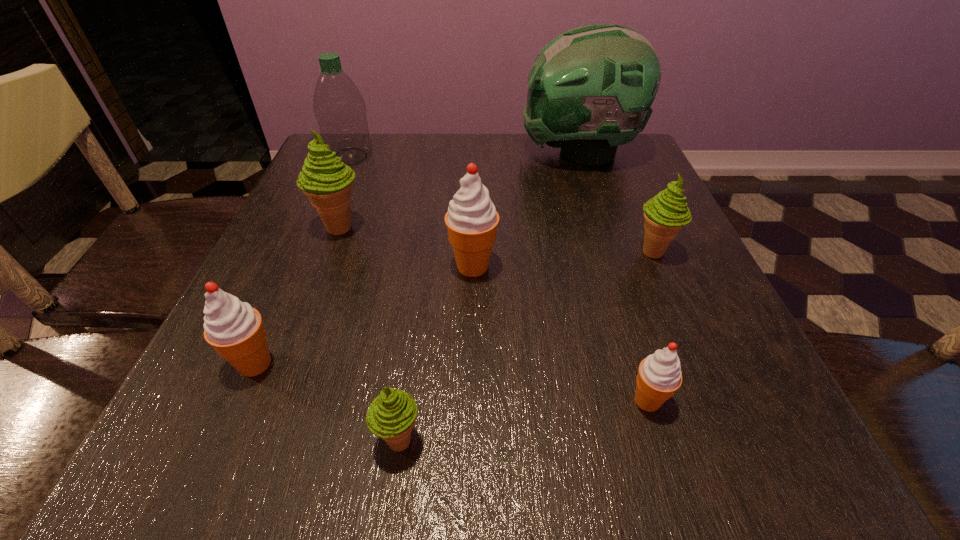
You are a GUI agent. You are given a task and a screenshot of the screen. Output one action in this format:
    pyautogui.click(x=<x>, y=<y>)
    Task: Click on the free region located 0.090m on the back of the second smallest red icecream
    The width and height of the screenshot is (960, 540).
    Given the screenshot: What is the action you would take?
    pyautogui.click(x=282, y=301)

Where is `vacant space located on the front of the smallest red icecream`? Image resolution: width=960 pixels, height=540 pixels. vacant space located on the front of the smallest red icecream is located at coordinates (664, 456).

I want to click on vacant area situated on the left of the fourth icecream from right to left, so pyautogui.click(x=282, y=441).

Where is `football helmet that is at the far edge`? football helmet that is at the far edge is located at coordinates (590, 89).

In order to click on water bottle that is at the far edge in this screenshot , I will do `click(340, 110)`.

Identify the location of water bottle present at the left edge. (340, 110).

Where is `football helmet located at the right edge`? football helmet located at the right edge is located at coordinates (590, 89).

In order to click on object positioned at the far left corner in this screenshot , I will do `click(340, 110)`.

Identify the location of object that is at the far right corner. The width and height of the screenshot is (960, 540). (590, 89).

The image size is (960, 540). In order to click on object located in the near right corner section of the desktop in this screenshot , I will do `click(659, 376)`.